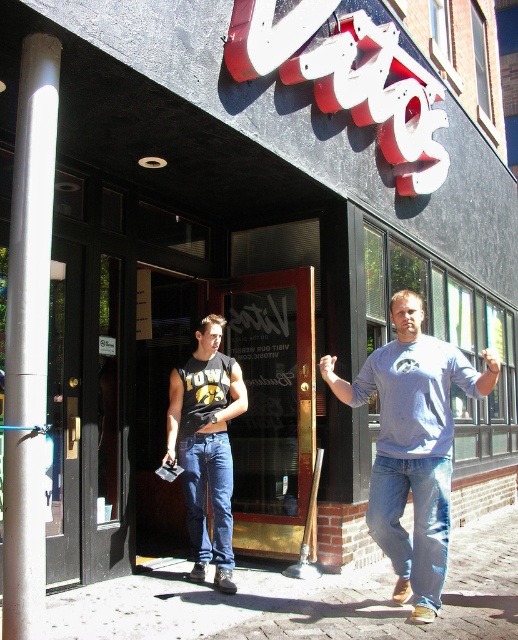
You are a tailor measuring a mannequin wearing the same clothing as the man in the image. The tailor needs to ensure the distance between the matte black tank top at center and denim jeans at center is appropriate for a comfortable fit. Given that the standard acceptable distance is between 8 to 10 centimeters, is the current distance within the acceptable range?

The distance between the matte black tank top at center and denim jeans at center is 9.63 centimeters, which falls within the standard acceptable range of 8 to 10 centimeters. Therefore, the current distance is appropriate for a comfortable fit.

You are standing in front of the building with the sign that reads Vatos. You notice the brick pavement at lower center and the light blue denim jeans at lower right. Which object is closer to the ground?

The brick pavement at lower center is closer to the ground because it is shorter than the light blue denim jeans at lower right.

Looking at this image, you are standing at the entrance of the building and want to walk to the point marked by point [190,468]. However, there is an obstacle at point [229,454]. Will you need to go around the obstacle to reach your destination?

Yes, you will need to go around the obstacle at point [229,454] because it is in front of point [190,468], blocking the direct path.